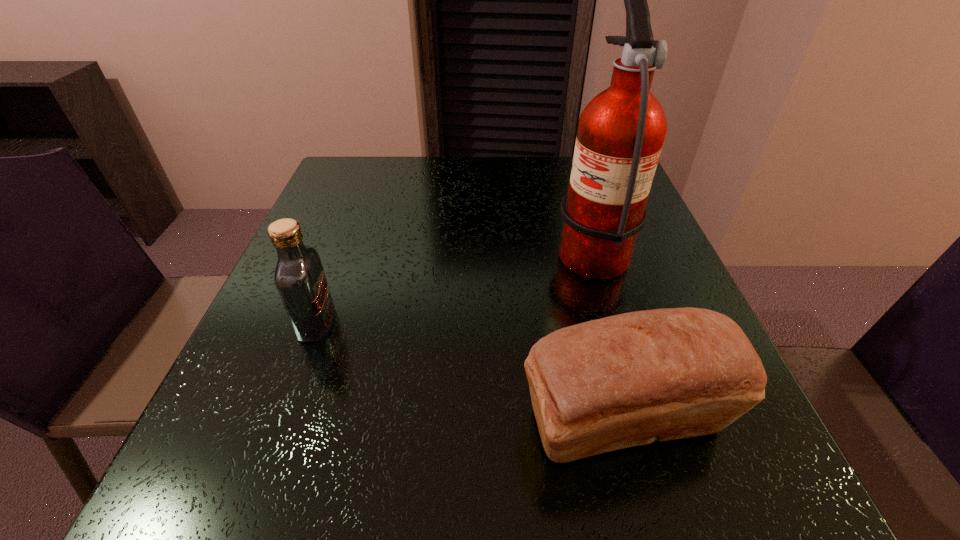
I want to click on vacant space that satisfies the following two spatial constraints: 1. on the front-facing side of the bread; 2. on the right side of the second farthest object, so click(x=281, y=420).

Locate an element on the screen. This screenshot has height=540, width=960. vacant area in the image that satisfies the following two spatial constraints: 1. on the front-facing side of the second nearest object; 2. on the left side of the nearest object is located at coordinates (281, 420).

Locate an element on the screen. This screenshot has height=540, width=960. vacant point that satisfies the following two spatial constraints: 1. on the front-facing side of the shortest object; 2. on the left side of the vodka is located at coordinates (281, 420).

Locate an element on the screen. Image resolution: width=960 pixels, height=540 pixels. vacant area that satisfies the following two spatial constraints: 1. on the front-facing side of the leftmost object; 2. on the back side of the nearest object is located at coordinates (281, 420).

This screenshot has width=960, height=540. In order to click on vacant space that satisfies the following two spatial constraints: 1. on the nozzle and handle of the tallest object; 2. on the front side of the bread in this screenshot , I will do `click(643, 420)`.

Identify the location of free space that satisfies the following two spatial constraints: 1. on the front-facing side of the bread; 2. on the right side of the second farthest object. (281, 420).

Where is `vacant point that satisfies the following two spatial constraints: 1. on the back side of the shortest object; 2. on the front-facing side of the second farthest object`? The image size is (960, 540). vacant point that satisfies the following two spatial constraints: 1. on the back side of the shortest object; 2. on the front-facing side of the second farthest object is located at coordinates (599, 323).